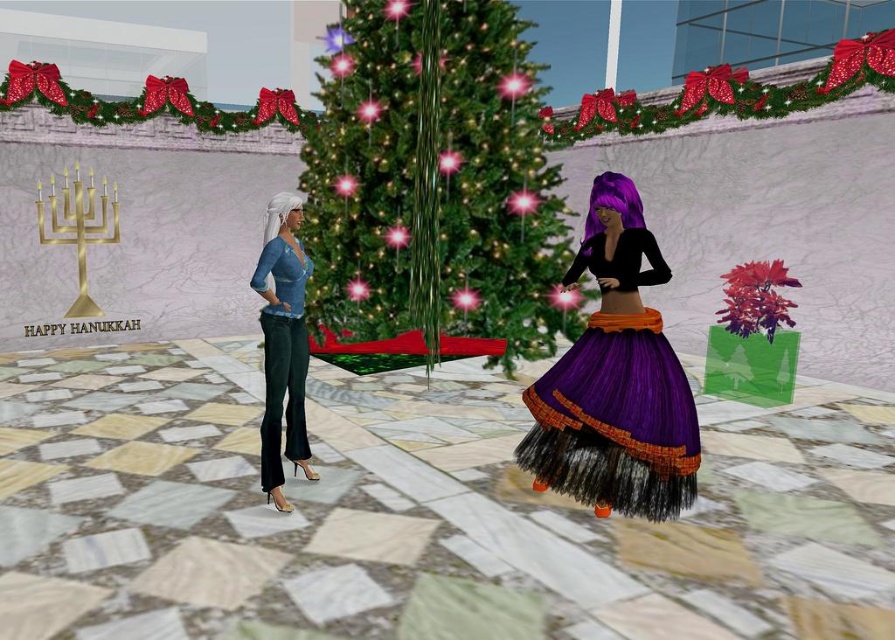
Question: Is green shiny christmas tree at center below velvet teal pants at left?

Choices:
 (A) yes
 (B) no

Answer: (B)

Question: Can you confirm if green shiny christmas tree at center is positioned to the right of velvet teal pants at left?

Choices:
 (A) no
 (B) yes

Answer: (B)

Question: Which point is closer to the camera?

Choices:
 (A) (337, 332)
 (B) (623, 499)
 (C) (280, 381)

Answer: (B)

Question: Considering the real-world distances, which object is closest to the green shiny christmas tree at center?

Choices:
 (A) velvet teal pants at left
 (B) purple tulle skirt at center

Answer: (A)

Question: Which of the following is the closest to the observer?

Choices:
 (A) (405, 145)
 (B) (276, 337)

Answer: (B)

Question: Does purple tulle skirt at center appear on the left side of velvet teal pants at left?

Choices:
 (A) no
 (B) yes

Answer: (A)